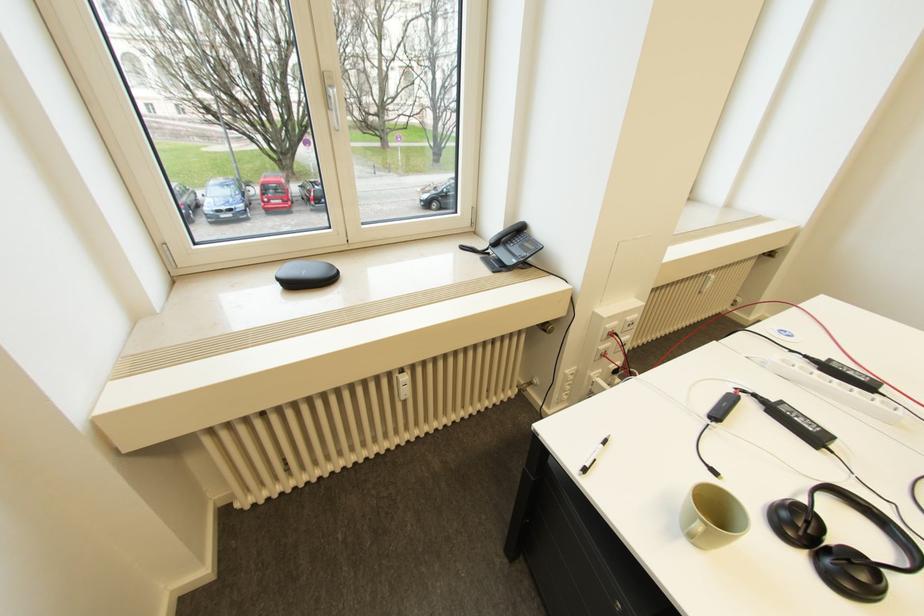
Describe the element at coordinates (506, 233) in the screenshot. I see `the telephone handset` at that location.